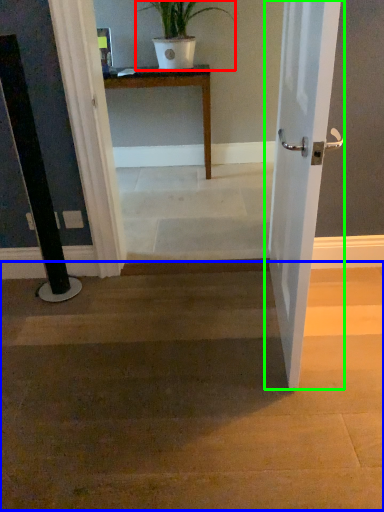
Question: Which object is the closest to the houseplant (highlighted by a red box)? Choose among these: stairwell (highlighted by a blue box) or door (highlighted by a green box).

Choices:
 (A) stairwell
 (B) door

Answer: (B)